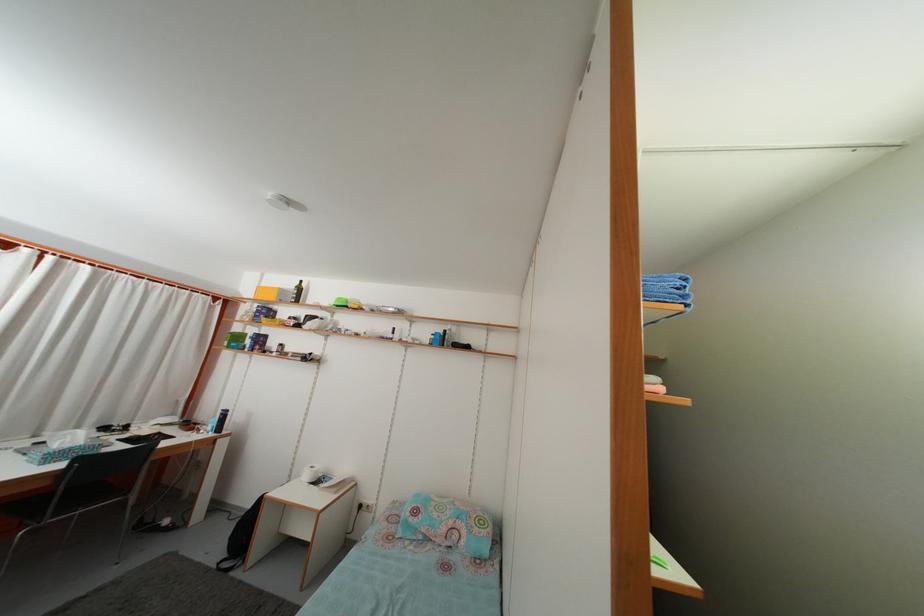
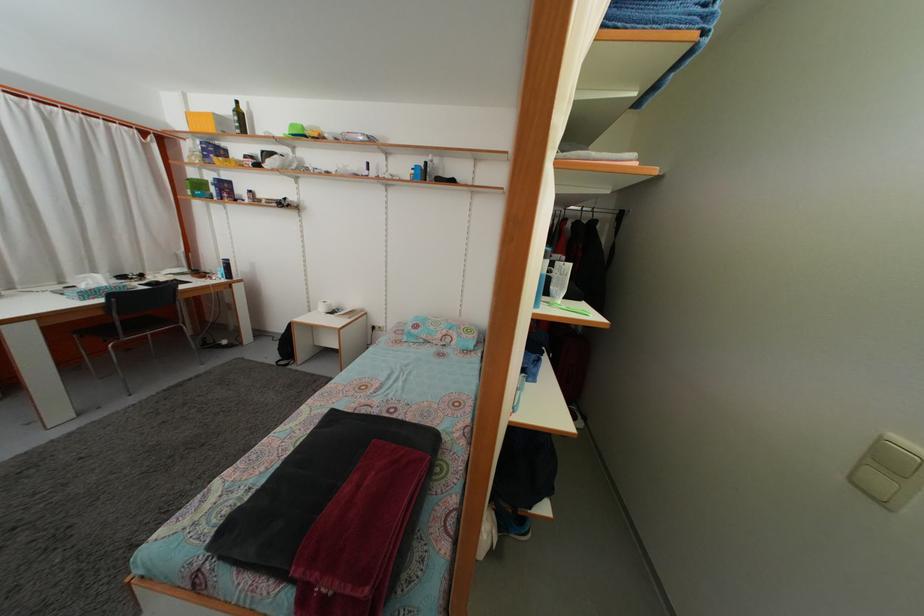
Where in the second image is the point corresponding to the point at 306,297 from the first image?

(246, 122)